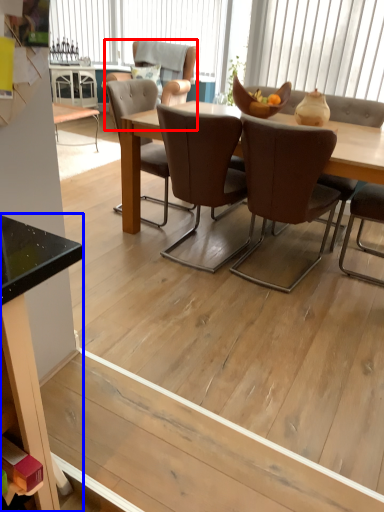
Question: Which object is closer to the camera taking this photo, chair (highlighted by a red box) or desk (highlighted by a blue box)?

Choices:
 (A) chair
 (B) desk

Answer: (B)